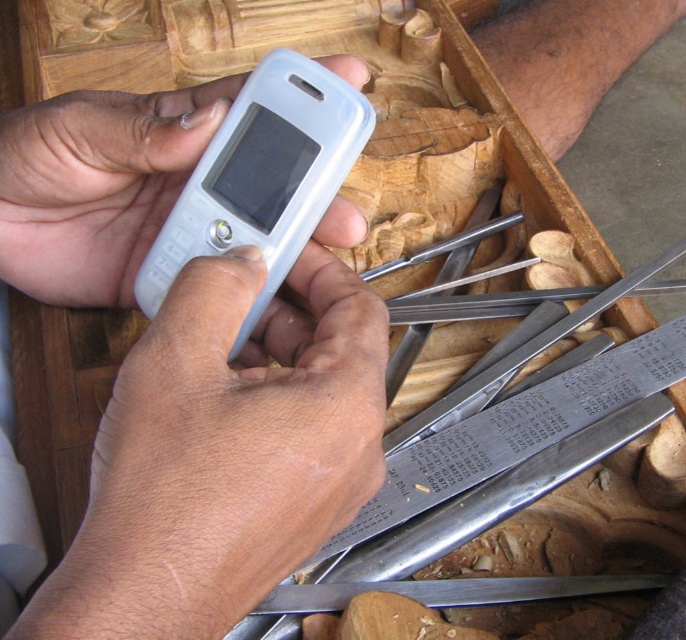
Question: Is white plastic phone at center thinner than white matte phone at center?

Choices:
 (A) yes
 (B) no

Answer: (B)

Question: Does white plastic phone at center appear on the right side of white matte phone at center?

Choices:
 (A) no
 (B) yes

Answer: (A)

Question: Among these objects, which one is farthest from the camera?

Choices:
 (A) white plastic phone at center
 (B) white matte phone at center

Answer: (B)

Question: Can you confirm if white plastic phone at center is thinner than white matte phone at center?

Choices:
 (A) no
 (B) yes

Answer: (A)